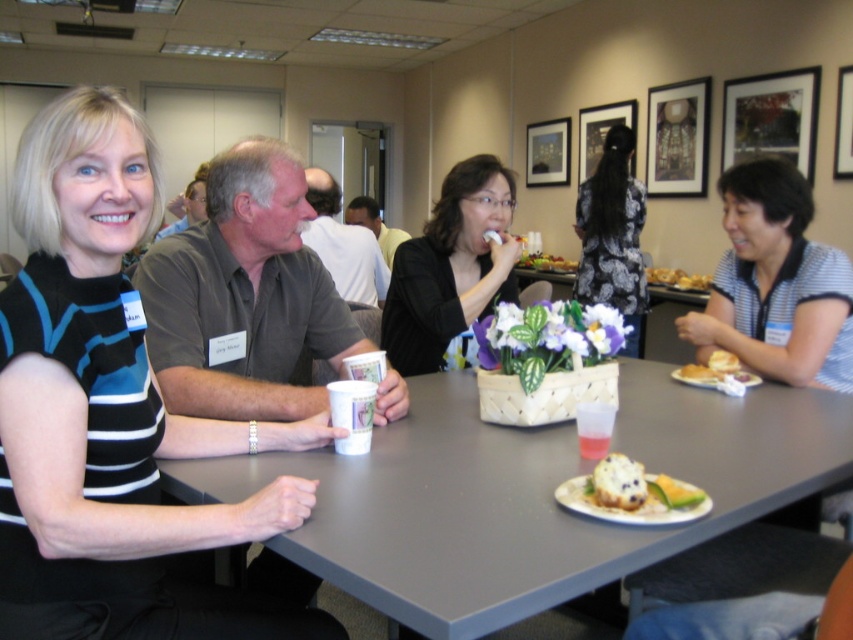
You are standing at the entrance of the room and want to locate the gray fabric shirt at center. Based on the coordinates provided, can you determine its location relative to the entrance?

The gray fabric shirt at center is located at coordinates point (343, 244), which would place it near the center of the image, but without additional spatial context about the room layout, it is difficult to precisely determine its position relative to the entrance.

You are a waiter at a restaurant and need to place a new order of golden brown bread at upper right on the table. The table has coordinates from 0 to 1 in both x and y directions. Where should you place it?

You should place the golden brown bread at upper right at the coordinates point (677, 278) on the table.

You need to place a new plate on the table. The plate is the same size as the golden brown bread at upper right. Will it fit on the gray plastic table at center?

The gray plastic table at center is bigger than the golden brown bread at upper right, so the plate will fit on the table.